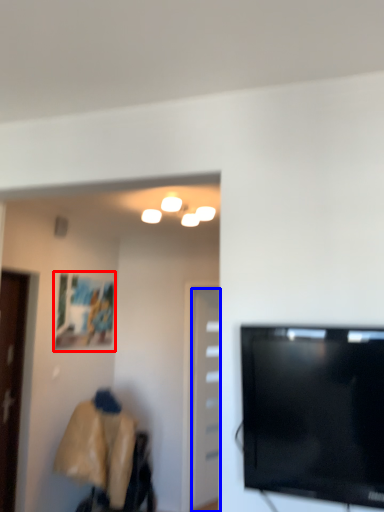
Question: Among these objects, which one is farthest to the camera, picture frame (highlighted by a red box) or door (highlighted by a blue box)?

Choices:
 (A) picture frame
 (B) door

Answer: (B)